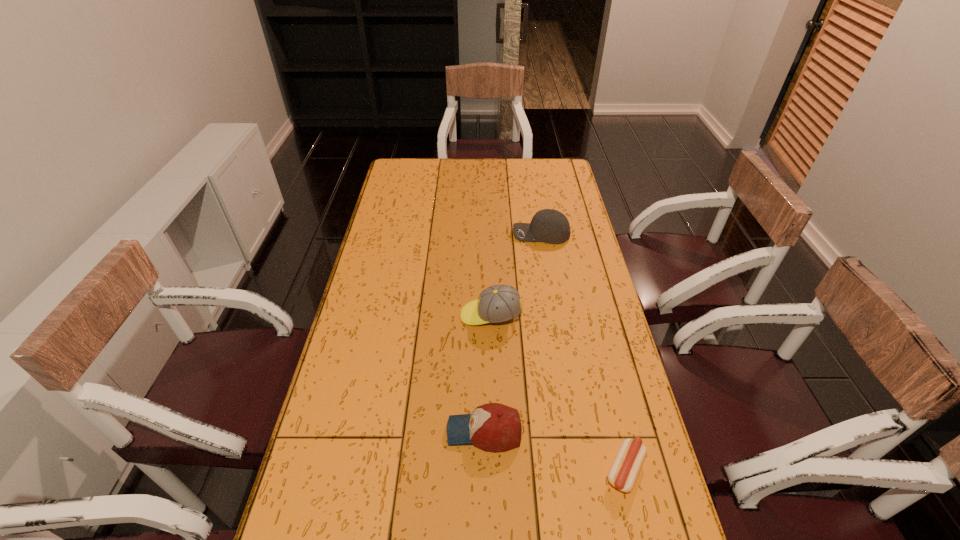
In the image, there is a desktop. Where is `vacant space at the far right corner`? vacant space at the far right corner is located at coordinates (550, 180).

The image size is (960, 540). What are the coordinates of `empty space between the second farthest baseball cap and the farthest baseball cap` in the screenshot? It's located at (516, 275).

This screenshot has height=540, width=960. Find the location of `empty space that is in between the farthest baseball cap and the third nearest object`. empty space that is in between the farthest baseball cap and the third nearest object is located at coordinates (516, 275).

This screenshot has height=540, width=960. I want to click on free spot between the second farthest object and the sausage, so click(558, 393).

Identify the location of free spot between the farthest baseball cap and the third nearest object. (516, 275).

The image size is (960, 540). I want to click on free space between the second nearest baseball cap and the third tallest object, so click(x=488, y=373).

Locate an element on the screen. vacant area that lies between the shortest object and the second shortest object is located at coordinates coord(555,451).

Where is `free space that is in between the second farthest baseball cap and the shortest object`? The image size is (960, 540). free space that is in between the second farthest baseball cap and the shortest object is located at coordinates (558, 393).

You are a GUI agent. You are given a task and a screenshot of the screen. Output one action in this format:
    pyautogui.click(x=<x>, y=<y>)
    Task: Click on the vacant point located between the third nearest object and the farthest baseball cap
    This screenshot has height=540, width=960.
    Given the screenshot: What is the action you would take?
    pyautogui.click(x=516, y=275)

What are the coordinates of `unoccupied area between the farthest object and the shortest baseball cap` in the screenshot? It's located at (513, 333).